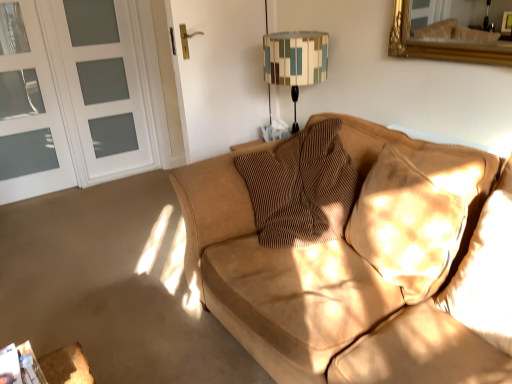
Question: Does white frosted glass screen door at left, which ranks as the first screen door in right-to-left order, have a lesser height compared to brown textured pillow at center, which is the 3th pillow from right to left?

Choices:
 (A) yes
 (B) no

Answer: (B)

Question: Considering the relative positions of white frosted glass screen door at left, which is the 2th screen door in left-to-right order, and brown textured pillow at center, which is the 3th pillow from right to left, in the image provided, is white frosted glass screen door at left, which is the 2th screen door in left-to-right order, to the left of brown textured pillow at center, which is the 3th pillow from right to left, from the viewer's perspective?

Choices:
 (A) yes
 (B) no

Answer: (A)

Question: Can you confirm if white frosted glass screen door at left, which ranks as the first screen door in right-to-left order, is smaller than brown textured pillow at center, positioned as the 1th pillow in left-to-right order?

Choices:
 (A) no
 (B) yes

Answer: (B)

Question: From a real-world perspective, is white frosted glass screen door at left, which ranks as the first screen door in right-to-left order, physically above brown textured pillow at center, positioned as the 1th pillow in left-to-right order?

Choices:
 (A) yes
 (B) no

Answer: (A)

Question: Considering the relative sizes of white frosted glass screen door at left, which ranks as the first screen door in right-to-left order, and brown textured pillow at center, which is the 3th pillow from right to left, in the image provided, is white frosted glass screen door at left, which ranks as the first screen door in right-to-left order, bigger than brown textured pillow at center, which is the 3th pillow from right to left,?

Choices:
 (A) yes
 (B) no

Answer: (B)

Question: Visually, is white frosted glass screen door at left, which ranks as the first screen door in right-to-left order, positioned to the left or to the right of suede pillow at right, which is the second pillow from left to right?

Choices:
 (A) left
 (B) right

Answer: (A)

Question: In the image, is white frosted glass screen door at left, which ranks as the first screen door in right-to-left order, positioned in front of or behind suede pillow at right, positioned as the second pillow in right-to-left order?

Choices:
 (A) front
 (B) behind

Answer: (B)

Question: From a real-world perspective, is white frosted glass screen door at left, which ranks as the first screen door in right-to-left order, physically located above or below suede pillow at right, positioned as the second pillow in right-to-left order?

Choices:
 (A) below
 (B) above

Answer: (B)

Question: Is white frosted glass screen door at left, which is the 2th screen door in left-to-right order, inside the boundaries of suede pillow at right, positioned as the second pillow in right-to-left order, or outside?

Choices:
 (A) inside
 (B) outside

Answer: (B)

Question: From the image's perspective, is white frosted glass screen door at left, which is the 2th screen door in left-to-right order, positioned above or below geometric fabric lampshade at upper center?

Choices:
 (A) above
 (B) below

Answer: (A)

Question: Considering the relative positions of white frosted glass screen door at left, which ranks as the first screen door in right-to-left order, and geometric fabric lampshade at upper center in the image provided, is white frosted glass screen door at left, which ranks as the first screen door in right-to-left order, to the left or to the right of geometric fabric lampshade at upper center?

Choices:
 (A) right
 (B) left

Answer: (B)

Question: From a real-world perspective, is white frosted glass screen door at left, which ranks as the first screen door in right-to-left order, positioned above or below geometric fabric lampshade at upper center?

Choices:
 (A) below
 (B) above

Answer: (A)

Question: Is white frosted glass screen door at left, which is the 2th screen door in left-to-right order, wider or thinner than geometric fabric lampshade at upper center?

Choices:
 (A) thin
 (B) wide

Answer: (A)

Question: From the image's perspective, is white glass screen door at left, placed as the 1th screen door when sorted from left to right, above or below geometric fabric lampshade at upper center?

Choices:
 (A) below
 (B) above

Answer: (B)

Question: Based on their positions, is white glass screen door at left, placed as the 1th screen door when sorted from left to right, located to the left or right of geometric fabric lampshade at upper center?

Choices:
 (A) right
 (B) left

Answer: (B)